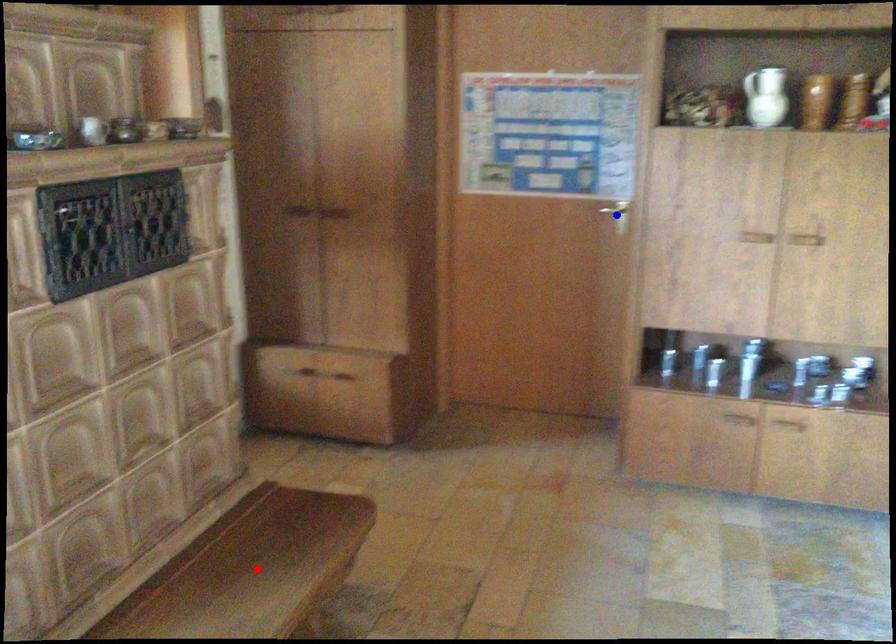
Question: In the image, two points are highlighted. Which point is nearer to the camera? Reply with the corresponding letter.

Choices:
 (A) blue point
 (B) red point

Answer: (B)